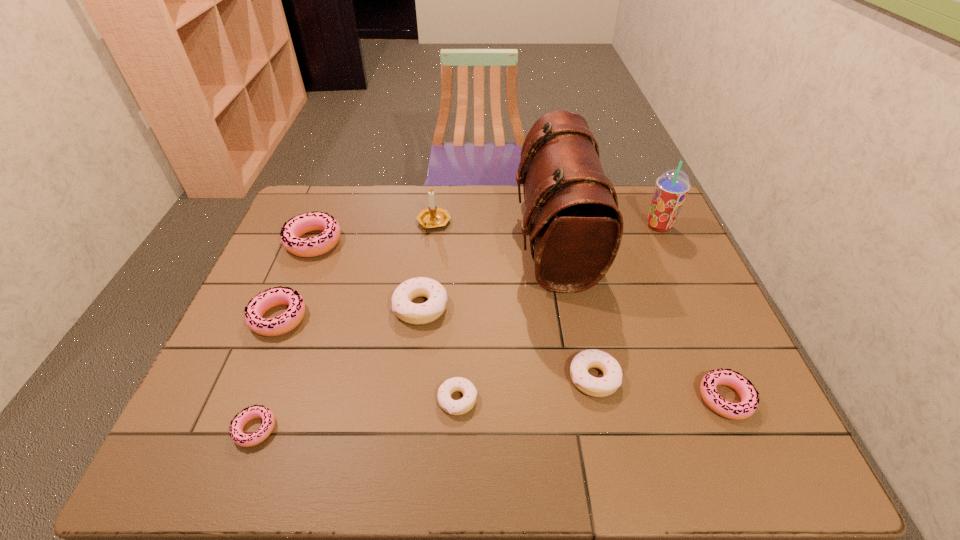
This screenshot has height=540, width=960. What are the coordinates of `free point located on the front of the farthest pink doughnut` in the screenshot? It's located at (283, 316).

Image resolution: width=960 pixels, height=540 pixels. I want to click on free space located 0.370m on the front of the biggest white doughnut, so click(400, 471).

What are the coordinates of `vacant space located 0.220m on the front of the second biggest pink doughnut` in the screenshot? It's located at point(236,420).

Identify the location of free space located 0.250m on the right of the second smallest white doughnut. Image resolution: width=960 pixels, height=540 pixels. tap(724, 377).

Find the location of a particular element. vacant space positioned on the left of the rightmost doughnut is located at coordinates [x=568, y=399].

At what (x,y) coordinates should I click in order to perform the action: click on vacant position located 0.300m on the back of the smallest white doughnut. Please return your answer as a coordinate pair (x, y). The height and width of the screenshot is (540, 960). Looking at the image, I should click on (462, 290).

You are a GUI agent. You are given a task and a screenshot of the screen. Output one action in this format:
    pyautogui.click(x=<x>, y=<y>)
    Task: Click on the free space located on the right of the smallest pink doughnut
    
    Given the screenshot: What is the action you would take?
    pyautogui.click(x=409, y=429)

Where is `satchel situated at the far edge`? satchel situated at the far edge is located at coordinates (572, 218).

Where is `smoothie at the far edge`? This screenshot has width=960, height=540. smoothie at the far edge is located at coordinates (672, 187).

Where is `candle holder situated at the far edge`? candle holder situated at the far edge is located at coordinates [x=432, y=217].